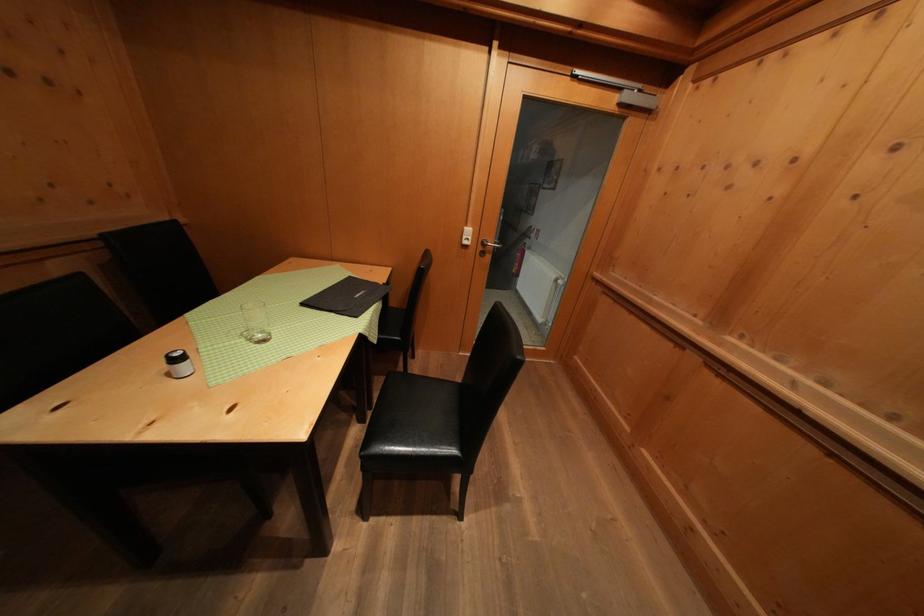
What do you see at coordinates (178, 363) in the screenshot?
I see `a small salt shaker` at bounding box center [178, 363].